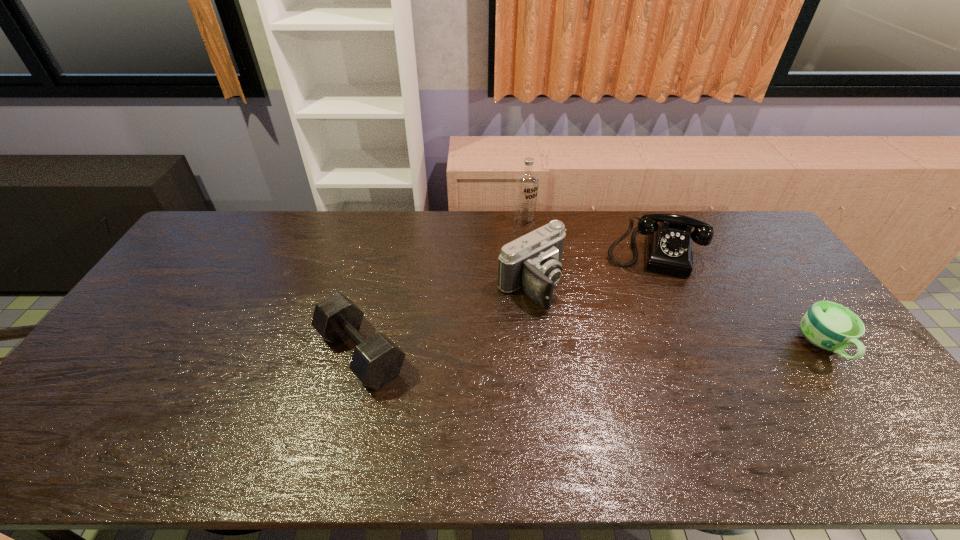
At what (x,y) coordinates should I click in order to perform the action: click on free region that satisfies the following two spatial constraints: 1. on the front side of the telephone; 2. on the right side of the tallest object. Please return your answer as a coordinate pair (x, y). The width and height of the screenshot is (960, 540). Looking at the image, I should click on (528, 252).

Find the location of `free space that satisfies the following two spatial constraints: 1. on the back side of the dumbbell; 2. on the left side of the telephone`. free space that satisfies the following two spatial constraints: 1. on the back side of the dumbbell; 2. on the left side of the telephone is located at coordinates (386, 252).

Image resolution: width=960 pixels, height=540 pixels. I want to click on free space that satisfies the following two spatial constraints: 1. on the back side of the camera; 2. on the left side of the vodka, so click(x=524, y=223).